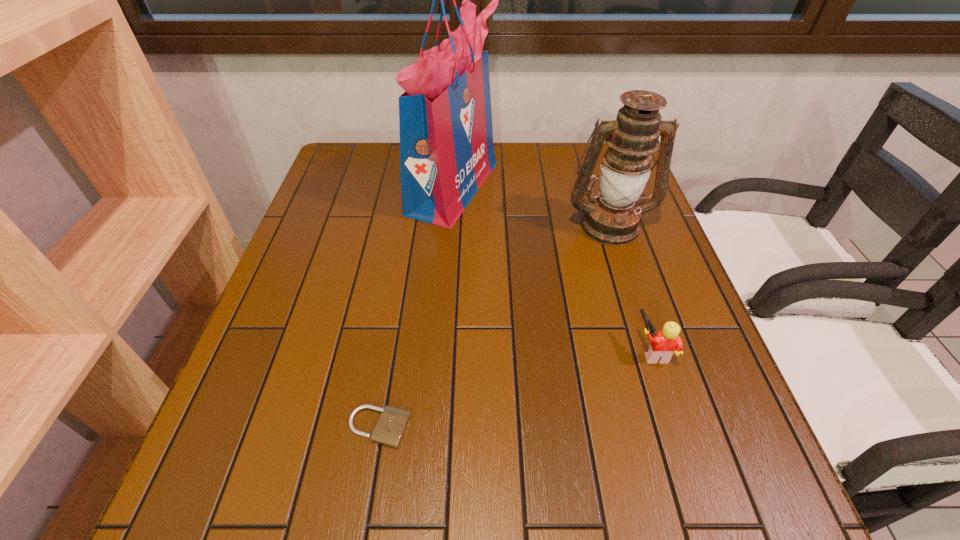
Locate an element on the screen. The width and height of the screenshot is (960, 540). vacant space at the near right corner is located at coordinates (724, 524).

The width and height of the screenshot is (960, 540). Find the location of `vacant space that's between the grocery bag and the lantern`. vacant space that's between the grocery bag and the lantern is located at coordinates [x=531, y=206].

Image resolution: width=960 pixels, height=540 pixels. I want to click on empty location between the shortest object and the third farthest object, so click(516, 389).

Locate an element on the screen. free space between the third farthest object and the lantern is located at coordinates (631, 288).

The image size is (960, 540). In order to click on free space between the third shortest object and the padlock in this screenshot , I will do `click(494, 326)`.

Locate an element on the screen. The height and width of the screenshot is (540, 960). unoccupied position between the padlock and the second shortest object is located at coordinates (516, 389).

In order to click on free area in between the second tallest object and the padlock in this screenshot , I will do `click(494, 326)`.

Find the location of a particular element. The width and height of the screenshot is (960, 540). vacant area that lies between the lantern and the tallest object is located at coordinates (531, 206).

Where is `vacant area between the grocery bag and the third farthest object`? The width and height of the screenshot is (960, 540). vacant area between the grocery bag and the third farthest object is located at coordinates (553, 269).

Image resolution: width=960 pixels, height=540 pixels. I want to click on blank region between the nearest object and the grocery bag, so tap(417, 307).